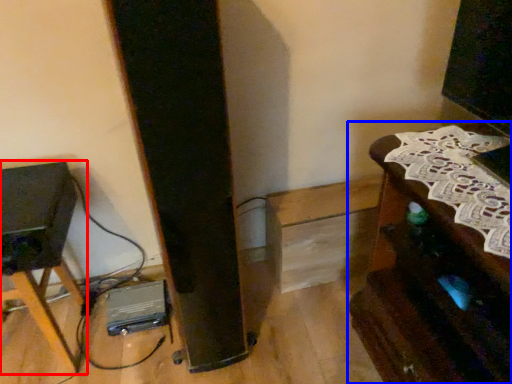
Question: Which object is closer to the camera taking this photo, furniture (highlighted by a red box) or furniture (highlighted by a blue box)?

Choices:
 (A) furniture
 (B) furniture

Answer: (B)